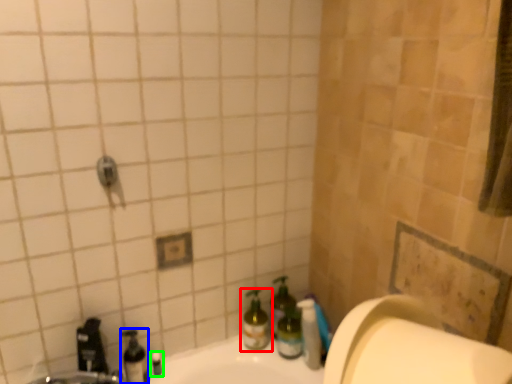
Question: Based on their relative distances, which object is farther from bottle (highlighted by a red box)? Choose from bottle (highlighted by a blue box) and toiletry (highlighted by a green box).

Choices:
 (A) bottle
 (B) toiletry

Answer: (A)